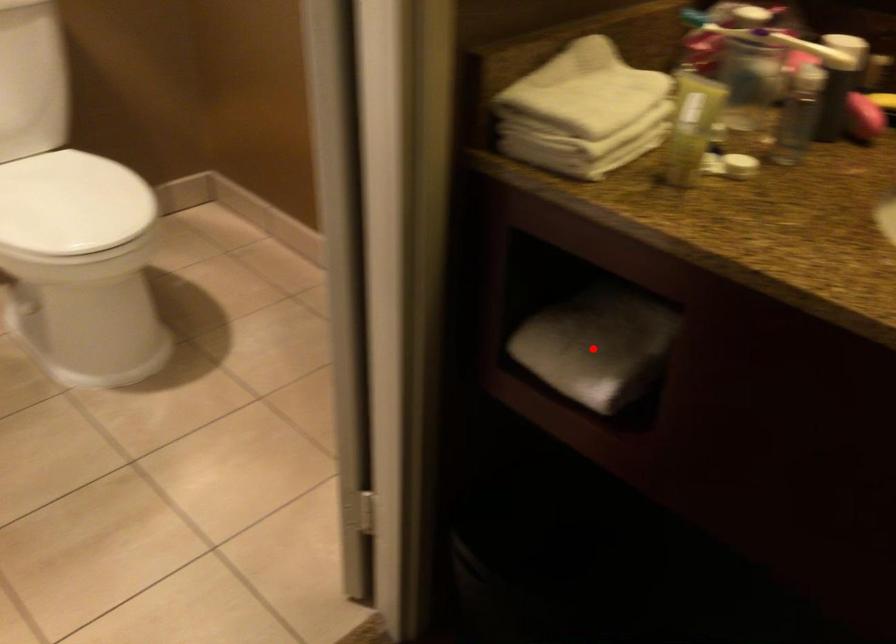
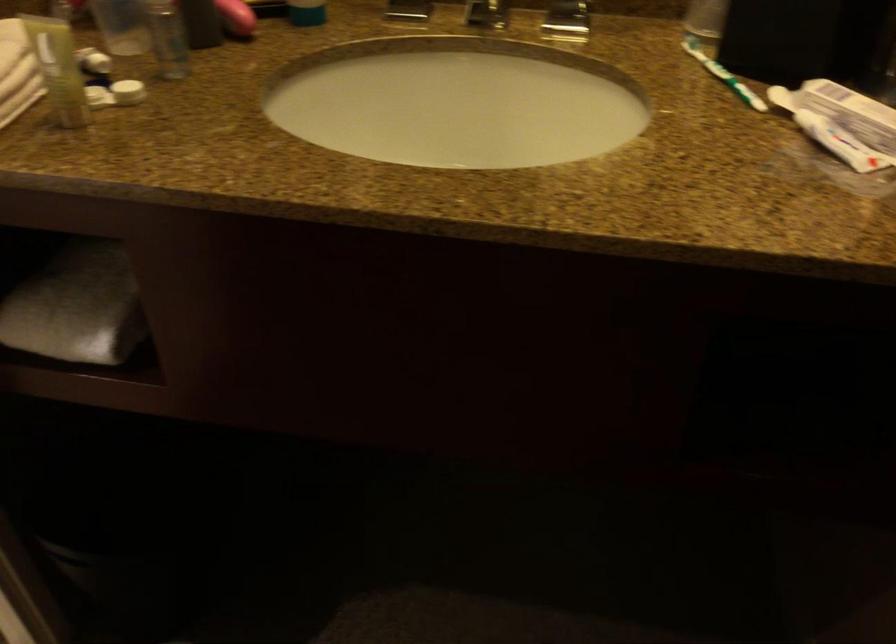
Find the pixel in the second image that matches the highlighted location in the first image.

(76, 306)